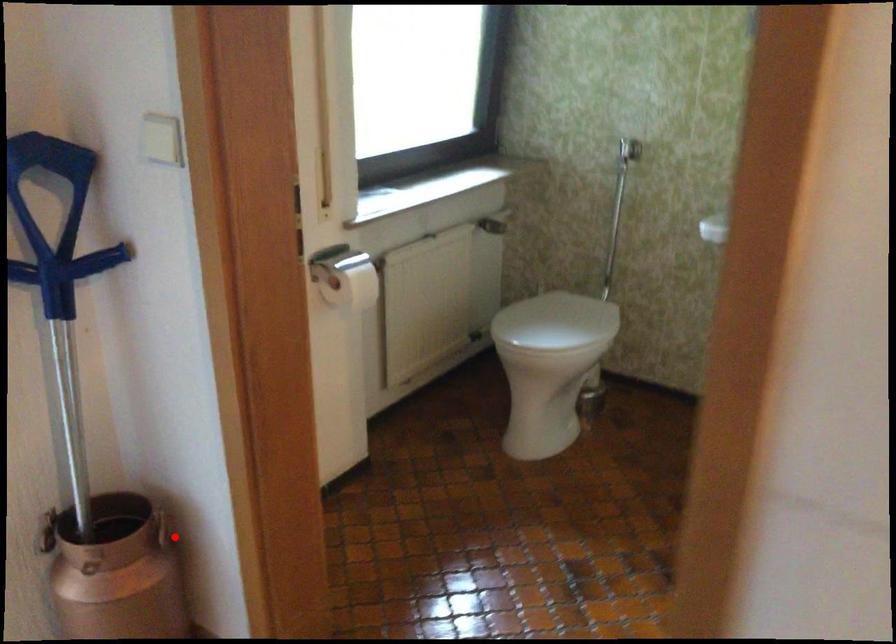
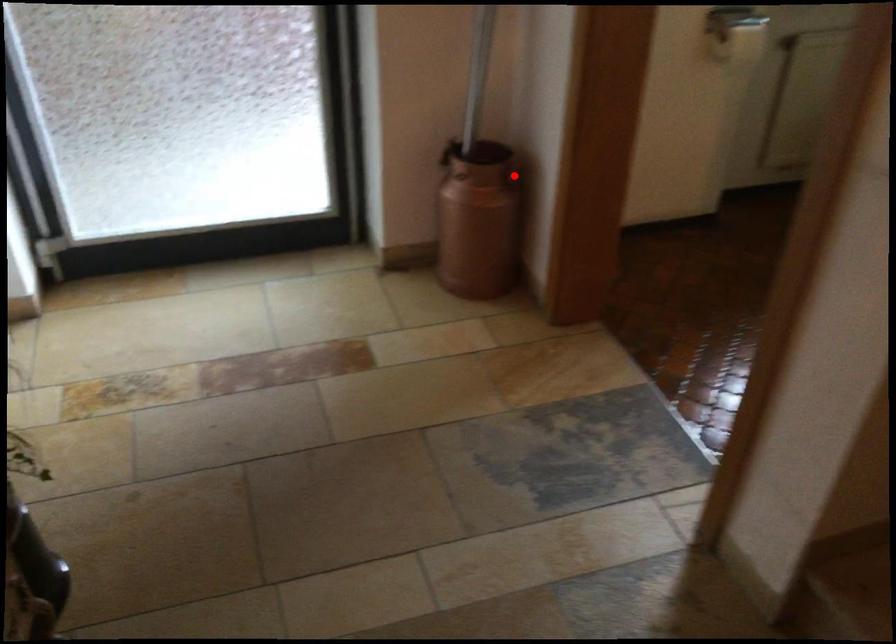
I am providing you with two images of the same scene from different viewpoints. A red point is marked on the first image and another point is marked on the second image. Does the point marked in image1 correspond to the same location as the one in image2?

Yes